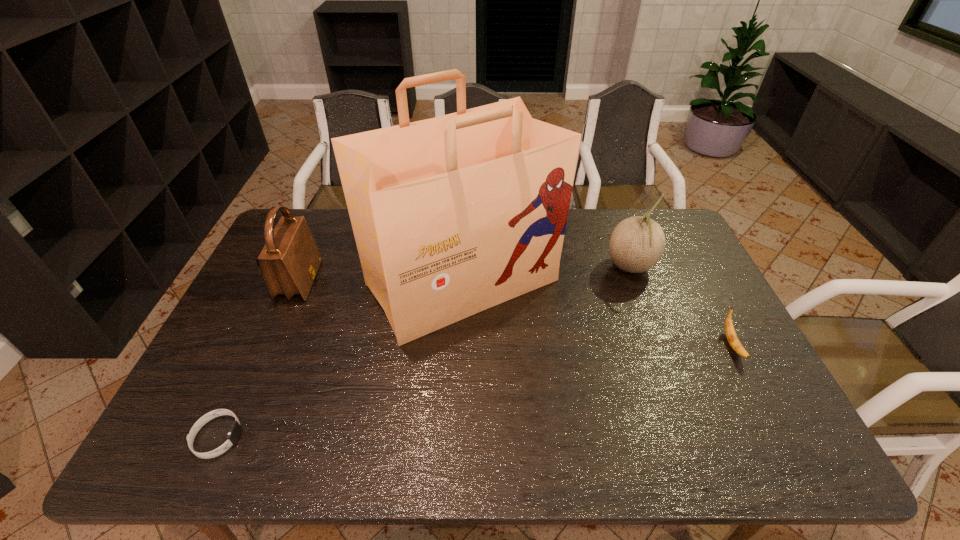
Where is `vacant space located 0.200m on the left of the cantaloup`? Image resolution: width=960 pixels, height=540 pixels. vacant space located 0.200m on the left of the cantaloup is located at coordinates click(543, 267).

Where is `vacant space located on the peel of the second shortest object from the top`? This screenshot has height=540, width=960. vacant space located on the peel of the second shortest object from the top is located at coordinates (756, 390).

Identify the location of free region located 0.080m on the outer surface of the shortest object. This screenshot has width=960, height=540. (276, 437).

The image size is (960, 540). In order to click on grocery bag situated at the far edge in this screenshot , I will do `click(452, 215)`.

Where is `cantaloup situated at the far edge`? Image resolution: width=960 pixels, height=540 pixels. cantaloup situated at the far edge is located at coordinates (637, 243).

Locate an element on the screen. The height and width of the screenshot is (540, 960). object located at the near edge is located at coordinates (235, 431).

You are a GUI agent. You are given a task and a screenshot of the screen. Output one action in this format:
    pyautogui.click(x=<x>, y=<y>)
    Task: Click on the shoulder bag situated at the left edge
    The image size is (960, 540).
    Given the screenshot: What is the action you would take?
    pyautogui.click(x=289, y=261)

I want to click on wristband located at the left edge, so click(x=235, y=431).

I want to click on cantaloup that is at the right edge, so click(x=637, y=243).

The height and width of the screenshot is (540, 960). What are the coordinates of `banana that is at the right edge` in the screenshot? It's located at (731, 335).